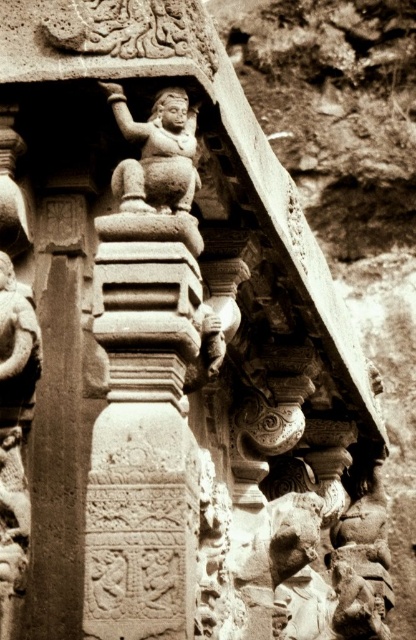
You are an archaeologist examining the ancient stone structure. You notice the carved stone column at center and the stone carved deity at upper center. Which object is taller?

The carved stone column at center is taller than the stone carved deity at upper center.

Based on the photo, based on the scene description, what is the significance of the point at coordinates (57, 426)?

The point at coordinates (57, 426) indicates a carved stone column at center.